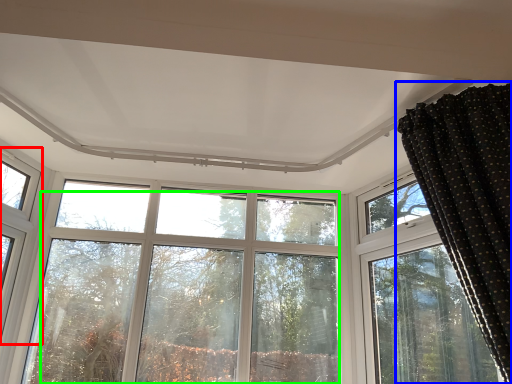
Question: Which is nearer to the window (highlighted by a red box)? curtain (highlighted by a blue box) or tree (highlighted by a green box).

Choices:
 (A) curtain
 (B) tree

Answer: (B)